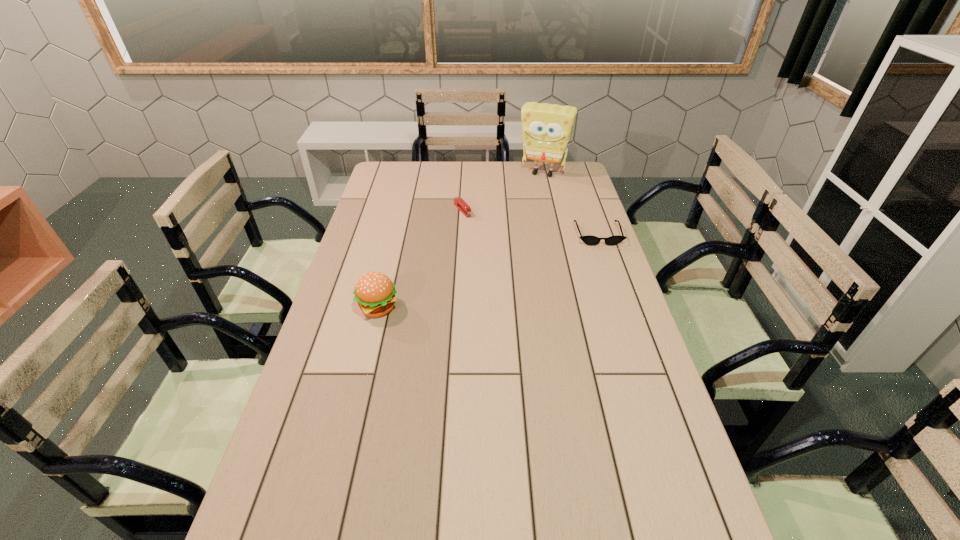
Image resolution: width=960 pixels, height=540 pixels. What are the coordinates of `vacant space on the desktop that is between the leftmost object and the second nearest object and is positioned on the face of the tallest object` in the screenshot? It's located at (502, 266).

The width and height of the screenshot is (960, 540). I want to click on free space on the desktop that is between the nearest object and the third farthest object and is positioned on the front-facing side of the second object from left to right, so click(x=513, y=263).